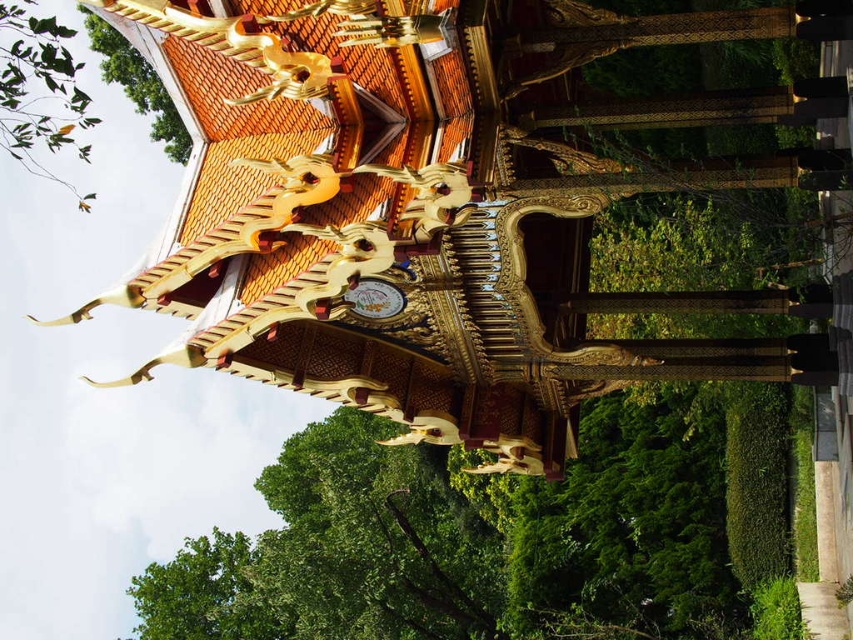
Does green leafy branch at upper left have a smaller size compared to green leafy tree at upper left?

No.

What do you see at coordinates (38, 90) in the screenshot?
I see `green leafy branch at upper left` at bounding box center [38, 90].

Describe the element at coordinates (38, 90) in the screenshot. I see `green leafy branch at upper left` at that location.

In order to click on green leafy branch at upper left in this screenshot , I will do `click(38, 90)`.

Is green leafy branch at upper left taller than gold metallic clock at center?

Yes, green leafy branch at upper left is taller than gold metallic clock at center.

Is green leafy branch at upper left shorter than gold metallic clock at center?

In fact, green leafy branch at upper left may be taller than gold metallic clock at center.

Between point (59, 120) and point (387, 298), which one is positioned behind?

The point (59, 120) is more distant.

You are a GUI agent. You are given a task and a screenshot of the screen. Output one action in this format:
    pyautogui.click(x=<x>, y=<y>)
    Task: Click on the green leafy branch at upper left
    This screenshot has height=640, width=853.
    Given the screenshot: What is the action you would take?
    pyautogui.click(x=38, y=90)

Does green leafy tree at upper left appear over gold metallic clock at center?

Correct, green leafy tree at upper left is located above gold metallic clock at center.

Find the location of a particular element. This screenshot has height=640, width=853. green leafy tree at upper left is located at coordinates (138, 84).

Is point (186, 144) positioned before point (347, 292)?

No.

This screenshot has width=853, height=640. I want to click on green leafy tree at upper left, so click(138, 84).